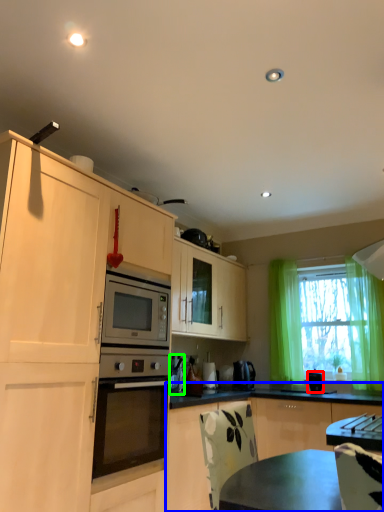
Question: Estimate the real-world distances between objects in this image. Which object is closer to appliance (highlighted by a red box), cabinetry (highlighted by a blue box) or appliance (highlighted by a green box)?

Choices:
 (A) cabinetry
 (B) appliance

Answer: (A)